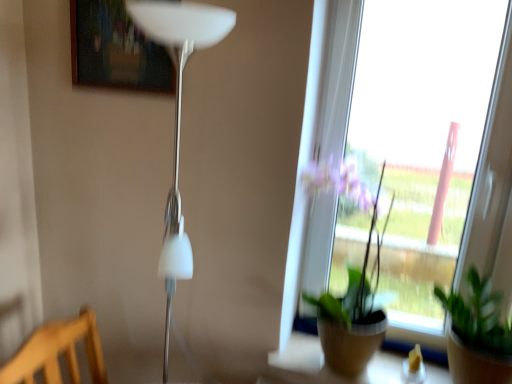
This screenshot has height=384, width=512. What are the coordinates of `wooden chair at lower left` in the screenshot? It's located at (58, 352).

This screenshot has height=384, width=512. I want to click on wooden frame at upper center, so click(x=116, y=50).

Based on the photo, in order to face white glossy floor lamp at left, should I rotate leftwards or rightwards?

You should rotate left by 10.933 degrees.

Describe the element at coordinates (178, 118) in the screenshot. I see `white glossy floor lamp at left` at that location.

This screenshot has height=384, width=512. What do you see at coordinates (477, 334) in the screenshot?
I see `green matte plant at lower right, arranged as the 1th houseplant when viewed from the right` at bounding box center [477, 334].

Find the location of `wooden chair at lower left`. wooden chair at lower left is located at coordinates (58, 352).

This screenshot has width=512, height=384. Find the location of `lamp located in front of the green matte plant at lower right, the second houseplant positioned from the left`. lamp located in front of the green matte plant at lower right, the second houseplant positioned from the left is located at coordinates (178, 118).

Is white glossy floor lamp at left located outside green matte plant at lower right, arranged as the 1th houseplant when viewed from the right?

white glossy floor lamp at left is positioned outside green matte plant at lower right, arranged as the 1th houseplant when viewed from the right.

How many degrees apart are the facing directions of white glossy floor lamp at left and green matte plant at lower right, arranged as the 1th houseplant when viewed from the right?

There is a 0.632-degree angle between the facing directions of white glossy floor lamp at left and green matte plant at lower right, arranged as the 1th houseplant when viewed from the right.

Is white glossy floor lamp at left taller than green matte plant at lower right, the second houseplant positioned from the left?

Indeed, white glossy floor lamp at left has a greater height compared to green matte plant at lower right, the second houseplant positioned from the left.

Which is in front, point (378, 279) or point (89, 349)?

The point (89, 349) is more forward.

From the image's perspective, is green matte plant at center, the 2th houseplant from the right, beneath wooden chair at lower left?

No, from the image's perspective, green matte plant at center, the 2th houseplant from the right, is not beneath wooden chair at lower left.

Is the depth of green matte plant at center, the 2th houseplant from the right, less than that of wooden chair at lower left?

No, green matte plant at center, the 2th houseplant from the right, is behind wooden chair at lower left.

This screenshot has height=384, width=512. I want to click on furniture that appears in front of the green matte plant at center, the 2th houseplant from the right, so click(x=58, y=352).

From the image's perspective, is green matte plant at lower right, the second houseplant positioned from the left, located above or below wooden frame at upper center?

Based on their image positions, green matte plant at lower right, the second houseplant positioned from the left, is located beneath wooden frame at upper center.

At what (x,y) coordinates should I click in order to perform the action: click on picture frame above the green matte plant at lower right, arranged as the 1th houseplant when viewed from the right (from a real-world perspective). Please return your answer as a coordinate pair (x, y). Looking at the image, I should click on (116, 50).

Is there a large distance between green matte plant at lower right, arranged as the 1th houseplant when viewed from the right, and wooden frame at upper center?

Absolutely, green matte plant at lower right, arranged as the 1th houseplant when viewed from the right, is distant from wooden frame at upper center.

Is wooden frame at upper center taller or shorter than green matte plant at center, marked as the 1th houseplant in a left-to-right arrangement?

In the image, wooden frame at upper center appears to be shorter than green matte plant at center, marked as the 1th houseplant in a left-to-right arrangement.

Is point (137, 81) closer or farther from the camera than point (369, 321)?

Point (137, 81).

Considering the positions of objects wooden frame at upper center and green matte plant at center, marked as the 1th houseplant in a left-to-right arrangement, in the image provided, who is more to the right, wooden frame at upper center or green matte plant at center, marked as the 1th houseplant in a left-to-right arrangement,?

green matte plant at center, marked as the 1th houseplant in a left-to-right arrangement.

Considering the sizes of objects wooden frame at upper center and green matte plant at center, marked as the 1th houseplant in a left-to-right arrangement, in the image provided, who is smaller, wooden frame at upper center or green matte plant at center, marked as the 1th houseplant in a left-to-right arrangement,?

With smaller size is wooden frame at upper center.

In the scene shown: Can you confirm if wooden frame at upper center is positioned to the left of green matte plant at lower right, arranged as the 1th houseplant when viewed from the right?

Yes.

Which of these two, wooden frame at upper center or green matte plant at lower right, arranged as the 1th houseplant when viewed from the right, is bigger?

green matte plant at lower right, arranged as the 1th houseplant when viewed from the right, is bigger.

Between point (133, 42) and point (501, 351), which one is positioned in front?

The point (501, 351) is in front.

From the image's perspective, which is below, green matte plant at lower right, the second houseplant positioned from the left, or wooden chair at lower left?

wooden chair at lower left, from the image's perspective.

Does green matte plant at lower right, the second houseplant positioned from the left, have a greater height compared to wooden chair at lower left?

Indeed, green matte plant at lower right, the second houseplant positioned from the left, has a greater height compared to wooden chair at lower left.

Does green matte plant at lower right, arranged as the 1th houseplant when viewed from the right, lie behind wooden chair at lower left?

Yes.

What are the coordinates of `the 2nd houseplant behind the wooden chair at lower left, starting your count from the anchor` in the screenshot? It's located at (477, 334).

Which of these two, wooden frame at upper center or white glossy floor lamp at left, is wider?

With larger width is white glossy floor lamp at left.

In the scene shown: Is wooden frame at upper center positioned with its back to white glossy floor lamp at left?

No, wooden frame at upper center is not facing the opposite direction of white glossy floor lamp at left.

From a real-world perspective, is wooden frame at upper center on top of white glossy floor lamp at left?

Yes, from a real-world perspective, wooden frame at upper center is above white glossy floor lamp at left.

Considering the positions of point (104, 54) and point (176, 150), is point (104, 54) closer or farther from the camera than point (176, 150)?

Point (104, 54).

You are a GUI agent. You are given a task and a screenshot of the screen. Output one action in this format:
    pyautogui.click(x=<x>, y=<y>)
    Task: Click on the lamp above the green matte plant at lower right, arranged as the 1th houseplant when viewed from the right (from a real-world perspective)
    The height and width of the screenshot is (384, 512).
    Given the screenshot: What is the action you would take?
    pyautogui.click(x=178, y=118)

Where is `furniture located underneath the green matte plant at center, the 2th houseplant from the right (from a real-world perspective)`? furniture located underneath the green matte plant at center, the 2th houseplant from the right (from a real-world perspective) is located at coordinates (58, 352).

Looking at the image, which one is located further to wooden frame at upper center, green matte plant at lower right, arranged as the 1th houseplant when viewed from the right, or white glossy floor lamp at left?

green matte plant at lower right, arranged as the 1th houseplant when viewed from the right.

When comparing their distances from green matte plant at lower right, the second houseplant positioned from the left, does green matte plant at center, the 2th houseplant from the right, or white glossy floor lamp at left seem closer?

Based on the image, green matte plant at center, the 2th houseplant from the right, appears to be nearer to green matte plant at lower right, the second houseplant positioned from the left.

Considering their positions, is wooden frame at upper center positioned closer to white glossy floor lamp at left than green matte plant at center, the 2th houseplant from the right?

Among the two, wooden frame at upper center is located nearer to white glossy floor lamp at left.

When comparing their distances from green matte plant at lower right, the second houseplant positioned from the left, does white glossy floor lamp at left or wooden chair at lower left seem closer?

white glossy floor lamp at left is closer to green matte plant at lower right, the second houseplant positioned from the left.

Looking at the image, which one is located closer to green matte plant at center, the 2th houseplant from the right, wooden chair at lower left or green matte plant at lower right, the second houseplant positioned from the left?

green matte plant at lower right, the second houseplant positioned from the left, lies closer to green matte plant at center, the 2th houseplant from the right, than the other object.

Based on their spatial positions, is green matte plant at center, marked as the 1th houseplant in a left-to-right arrangement, or wooden chair at lower left further from wooden frame at upper center?

green matte plant at center, marked as the 1th houseplant in a left-to-right arrangement, is further to wooden frame at upper center.

From the image, which object appears to be nearer to wooden chair at lower left, wooden frame at upper center or green matte plant at lower right, the second houseplant positioned from the left?

wooden frame at upper center is positioned closer to the anchor wooden chair at lower left.

Consider the image. From the image, which object appears to be nearer to green matte plant at center, the 2th houseplant from the right, white glossy floor lamp at left or green matte plant at lower right, arranged as the 1th houseplant when viewed from the right?

green matte plant at lower right, arranged as the 1th houseplant when viewed from the right, lies closer to green matte plant at center, the 2th houseplant from the right, than the other object.

Identify the location of lamp between wooden frame at upper center and wooden chair at lower left vertically. The height and width of the screenshot is (384, 512). (178, 118).

You are a GUI agent. You are given a task and a screenshot of the screen. Output one action in this format:
    pyautogui.click(x=<x>, y=<y>)
    Task: Click on the lamp between wooden frame at upper center and green matte plant at center, the 2th houseplant from the right, in the up-down direction
    This screenshot has height=384, width=512.
    Given the screenshot: What is the action you would take?
    pyautogui.click(x=178, y=118)

Find the location of a particular element. Image resolution: width=512 pixels, height=384 pixels. picture frame between wooden chair at lower left and green matte plant at lower right, arranged as the 1th houseplant when viewed from the right, from left to right is located at coordinates (116, 50).

Identify the location of lamp situated between wooden chair at lower left and green matte plant at center, marked as the 1th houseplant in a left-to-right arrangement, from left to right. (178, 118).